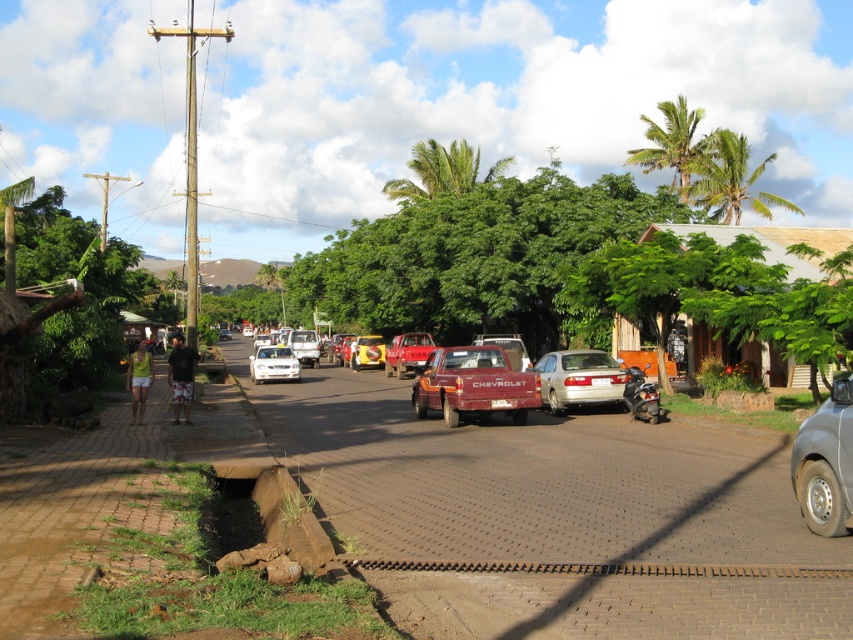
Between silver metallic sedan at center and red matte pickup truck at center, which one is positioned higher?

red matte pickup truck at center is above.

You are a GUI agent. You are given a task and a screenshot of the screen. Output one action in this format:
    pyautogui.click(x=<x>, y=<y>)
    Task: Click on the silver metallic sedan at center
    The image size is (853, 640).
    Given the screenshot: What is the action you would take?
    point(579,380)

Between point (614, 372) and point (421, 337), which one is positioned in front?

Point (614, 372) is more forward.

You are a GUI agent. You are given a task and a screenshot of the screen. Output one action in this format:
    pyautogui.click(x=<x>, y=<y>)
    Task: Click on the silver metallic sedan at center
    This screenshot has height=640, width=853.
    Given the screenshot: What is the action you would take?
    pyautogui.click(x=579, y=380)

Does white glossy sedan at center lie behind matte red truck at center?

Yes.

Is white glossy sedan at center to the left of matte red truck at center from the viewer's perspective?

Yes, white glossy sedan at center is to the left of matte red truck at center.

The image size is (853, 640). What do you see at coordinates (273, 364) in the screenshot? I see `white glossy sedan at center` at bounding box center [273, 364].

At what (x,y) coordinates should I click in order to perform the action: click on white glossy sedan at center. Please return your answer as a coordinate pair (x, y). This screenshot has width=853, height=640. Looking at the image, I should click on (273, 364).

Does yellow matte car at center have a smaller size compared to white glossy car at center?

Yes, yellow matte car at center is smaller than white glossy car at center.

Does yellow matte car at center appear under white glossy car at center?

Yes.

This screenshot has width=853, height=640. What do you see at coordinates (367, 352) in the screenshot?
I see `yellow matte car at center` at bounding box center [367, 352].

Locate an element on the screen. The height and width of the screenshot is (640, 853). yellow matte car at center is located at coordinates (367, 352).